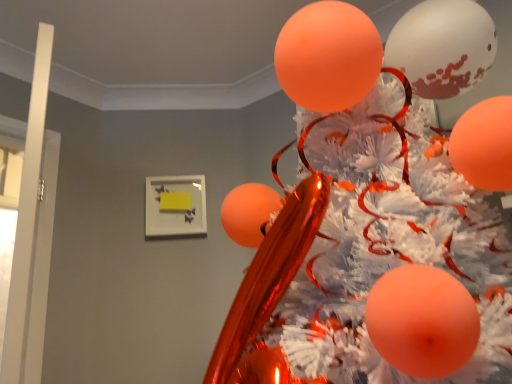
This screenshot has height=384, width=512. Find the location of `white fluffy christmas tree at upper center`. white fluffy christmas tree at upper center is located at coordinates click(x=364, y=247).

In order to face white fluffy christmas tree at upper center, should I rotate leftwards or rightwards?

Turn right approximately 11.546 degrees to face it.

What do you see at coordinates (364, 247) in the screenshot?
I see `white fluffy christmas tree at upper center` at bounding box center [364, 247].

Find the location of a particular element. The height and width of the screenshot is (384, 512). white fluffy christmas tree at upper center is located at coordinates (364, 247).